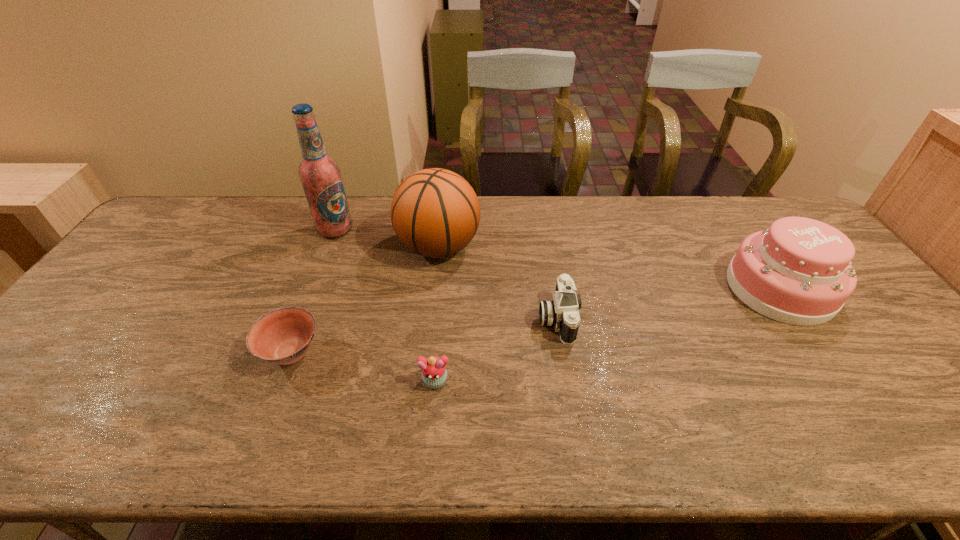
Locate an element on the screen. This screenshot has height=540, width=960. alcohol is located at coordinates (320, 175).

Where is `the fifth shortest object`? The image size is (960, 540). the fifth shortest object is located at coordinates (435, 213).

The image size is (960, 540). Find the location of `the rightmost object`. the rightmost object is located at coordinates (x=798, y=271).

Locate an element on the screen. the third tallest object is located at coordinates (798, 271).

Find the location of `the fifth object from left to right`. the fifth object from left to right is located at coordinates (562, 313).

In order to click on camera in this screenshot , I will do `click(562, 313)`.

This screenshot has height=540, width=960. I want to click on cupcake, so click(434, 373).

Locate an element on the screen. The height and width of the screenshot is (540, 960). bowl is located at coordinates (283, 336).

Locate an element on the screen. The height and width of the screenshot is (540, 960). free space located on the right of the tallest object is located at coordinates (472, 230).

Identify the location of free point located on the right of the basketball. The width and height of the screenshot is (960, 540). (550, 246).